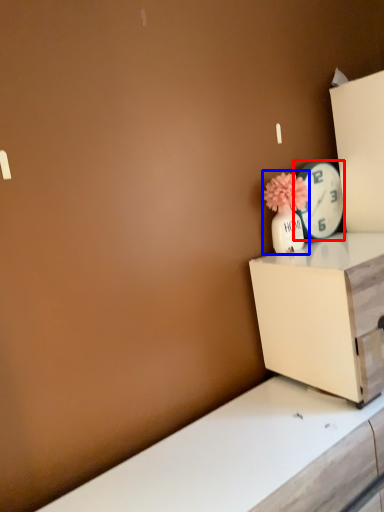
Question: Which of the following is the closest to the observer, clock (highlighted by a red box) or floral arrangement (highlighted by a blue box)?

Choices:
 (A) clock
 (B) floral arrangement

Answer: (B)